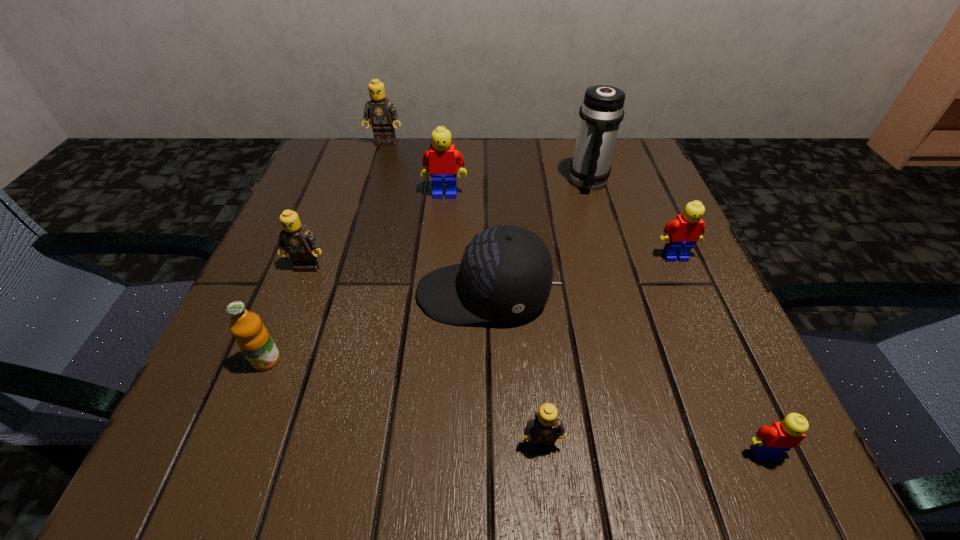
Where is `vacant point located in front of the second nearest tan Lego`? The height and width of the screenshot is (540, 960). vacant point located in front of the second nearest tan Lego is located at coordinates (231, 464).

Locate an element on the screen. vacant space located on the label of the orange juice is located at coordinates (234, 441).

What are the coordinates of `thermos bottle that is at the far edge` in the screenshot? It's located at [602, 111].

The width and height of the screenshot is (960, 540). I want to click on orange juice present at the left edge, so pyautogui.click(x=252, y=337).

I want to click on thermos bottle located at the right edge, so click(x=602, y=111).

Identify the location of object present at the far left corner. (381, 112).

Find the location of a particular element. This screenshot has height=540, width=960. object present at the far right corner is located at coordinates (602, 111).

Identify the location of object that is at the near right corner. (771, 441).

Identify the location of blank space at the far edge of the desktop. The image size is (960, 540). (403, 188).

What are the coordinates of `vacant space at the near edge of the desktop` in the screenshot? It's located at (383, 441).